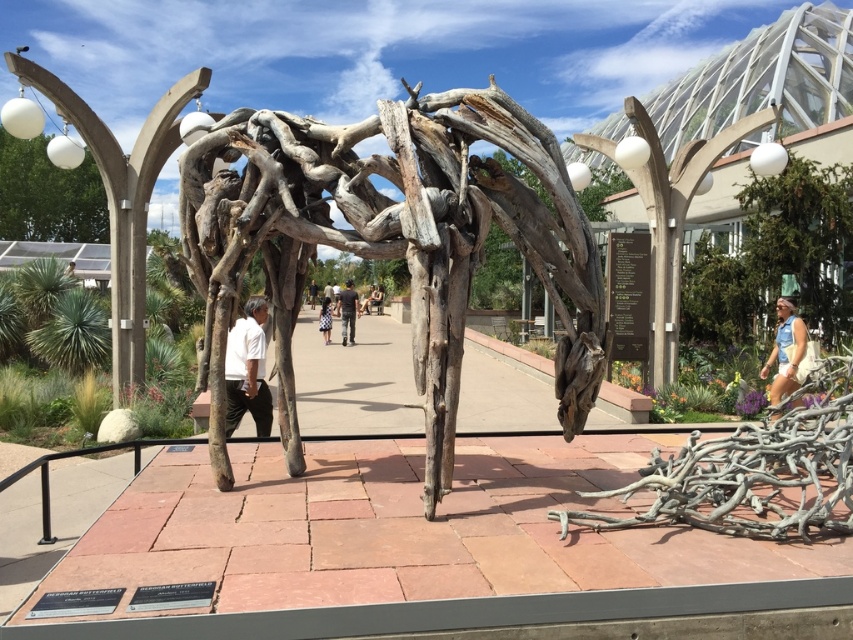
You are standing at the entrance of the wooden sculpture and see the denim shorts at lower right and the light brown wooden stick at center. Which object is closer to your right side?

The denim shorts at lower right is positioned on the right side of light brown wooden stick at center, so it is closer to your right side.

You are a photographer setting up a tripod in the outdoor scene. You need to place the tripod so that it doesn not block the view of the wooden sculpture. The denim shorts at lower right and the light brown wooden stick at center are in the foreground. Which object should you avoid placing the tripod in front of to keep the sculpture visible?

You should avoid placing the tripod in front of the denim shorts at lower right because it is much taller than the light brown wooden stick at center and could obstruct the view of the wooden sculpture.

You are standing in front of the wooden sculpture on the raised platform. You notice a gray driftwood at lower right. If you want to reach it without moving from your current position, can you touch it with a 10 feet long pole?

The gray driftwood at lower right is 8.90 feet away from the camera. Since the pole is 10 feet long, you can reach it by extending the pole towards the gray driftwood at lower right.